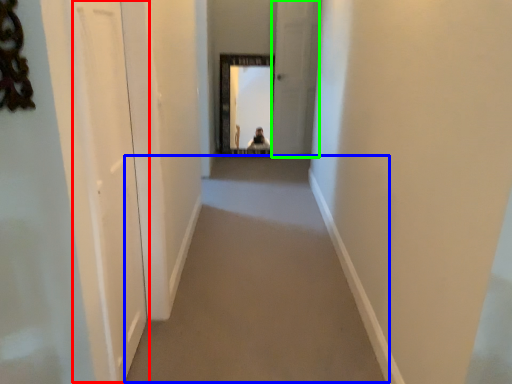
Question: Which object is the farthest from screen door (highlighted by a red box)? Choose among these: corridor (highlighted by a blue box) or screen door (highlighted by a green box).

Choices:
 (A) corridor
 (B) screen door

Answer: (B)